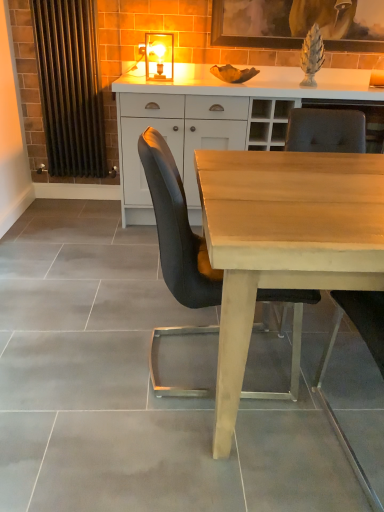
Question: In the image, is wooden picture frame at upper center on the left side or the right side of metallic radiator at left?

Choices:
 (A) left
 (B) right

Answer: (B)

Question: Is wooden picture frame at upper center in front of or behind metallic radiator at left in the image?

Choices:
 (A) front
 (B) behind

Answer: (B)

Question: Based on their relative distances, which object is farther from the light brown wood desk at center?

Choices:
 (A) wooden picture frame at upper center
 (B) white matte cabinet at center
 (C) metallic radiator at left
 (D) matte wood chair at center, the 1th chair from the right
 (E) matte glass lampshade at upper center

Answer: (C)

Question: Based on their relative distances, which object is nearer to the wooden picture frame at upper center?

Choices:
 (A) matte glass lampshade at upper center
 (B) white matte cabinet at center
 (C) metallic radiator at left
 (D) matte black chair at center, the second chair in the right-to-left sequence
 (E) light brown wood desk at center

Answer: (A)